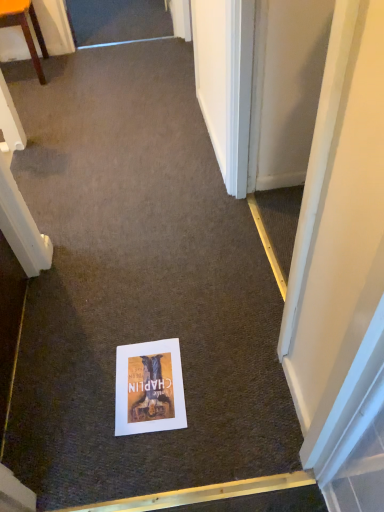
Identify the location of free space in front of matte paper poster at center. The image size is (384, 512). (148, 462).